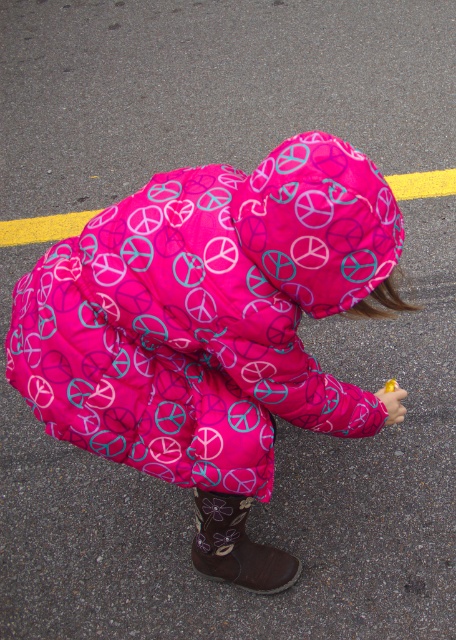
How distant is pink quilted coat at center from brown suede boot at lower center?

The distance of pink quilted coat at center from brown suede boot at lower center is 9.99 inches.

Between pink quilted coat at center and brown suede boot at lower center, which one appears on the left side from the viewer's perspective?

pink quilted coat at center

Does point (216, 417) come closer to viewer compared to point (217, 552)?

Yes, point (216, 417) is closer to viewer.

Identify the location of pink quilted coat at center. The image size is (456, 640). (210, 330).

In the scene shown: Between pink quilted coat at center and yellow matte food at lower right, which one is positioned lower?

Positioned lower is yellow matte food at lower right.

In the scene shown: Who is more forward, (x=229, y=205) or (x=397, y=384)?

Positioned in front is point (x=229, y=205).

Find the location of a particular element. This screenshot has height=640, width=456. pink quilted coat at center is located at coordinates (210, 330).

Locate an element on the screen. This screenshot has width=456, height=640. pink quilted coat at center is located at coordinates (210, 330).

Is point (253, 236) positioned after point (383, 403)?

No, it is not.

Does point (41, 314) lie behind point (399, 406)?

No, (41, 314) is in front of (399, 406).

Where is `pink quilted coat at center`? The width and height of the screenshot is (456, 640). pink quilted coat at center is located at coordinates (210, 330).